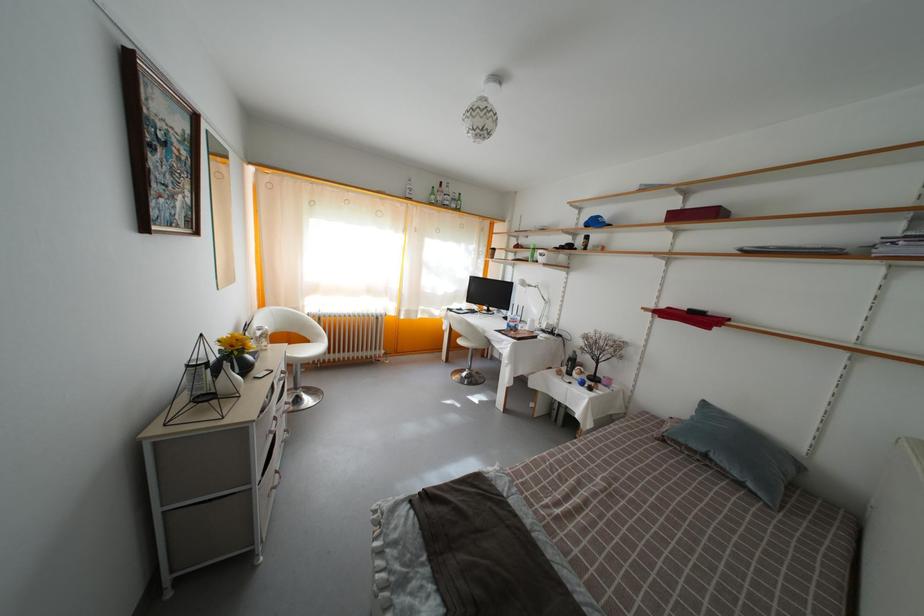
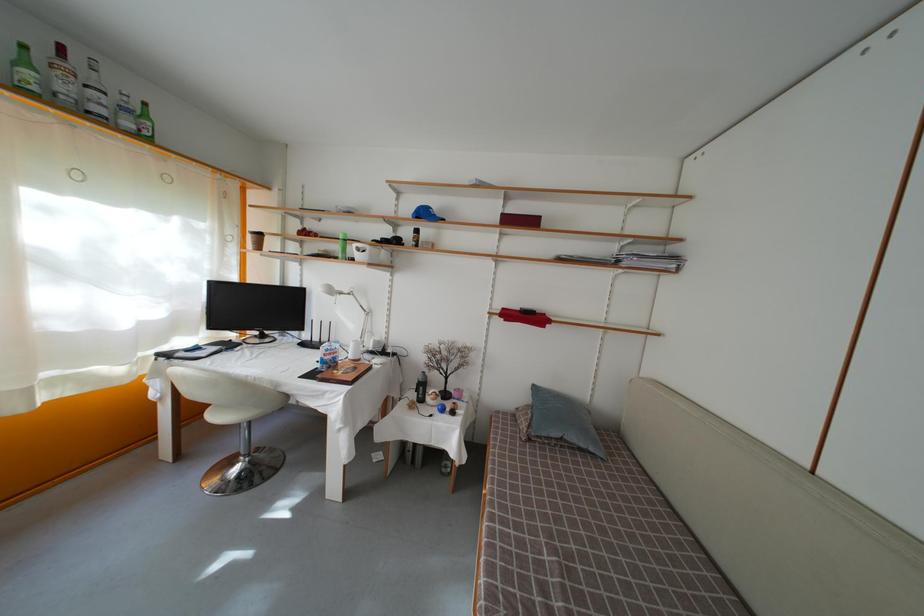
Where in the second image is the point corresponding to pixel 690 208 from the first image?

(509, 213)